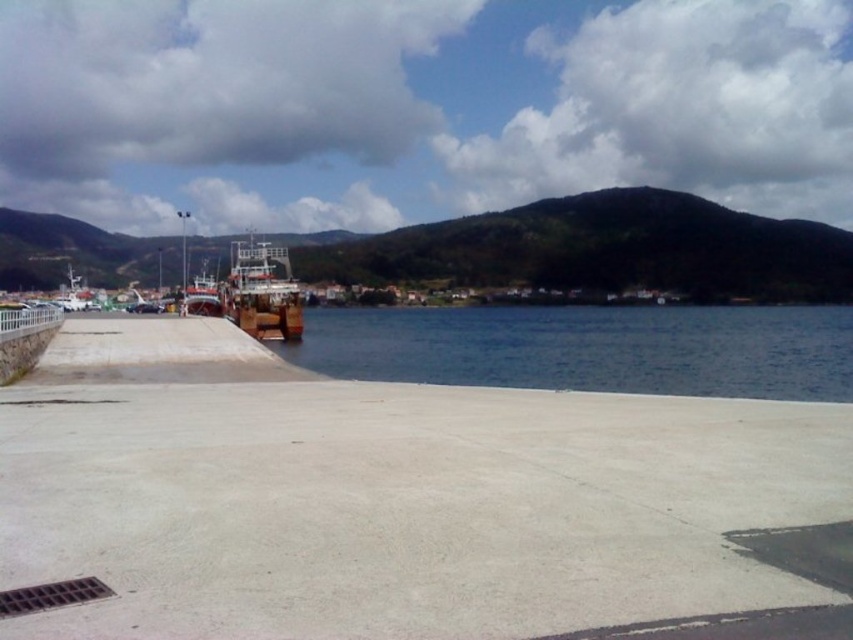
You are standing on the pier and want to board the wooden boat at center. Is the blue water at center between you and the boat, or behind the boat?

The blue water at center has a lesser height compared to wooden boat at center, so the blue water at center is between you and the wooden boat at center.

You are standing on the pier and want to take a photo of the wooden boat at left and the blue water at center. Which object should you point your camera towards first if you want to capture both in one shot?

You should point your camera towards the wooden boat at left first since it is positioned to the left of the blue water at center, allowing both to be captured in the frame.

You are standing on the concrete pavement at the pier and notice two points marked on the ground. One is labeled as point (x=334, y=326) and the other as point (x=94, y=298). If you were to walk from the first point towards the water, would you pass by the second point along the way?

Yes, because point (x=334, y=326) is in front of point (x=94, y=298), meaning it is closer to the water. Walking from point (x=334, y=326) towards the water would not require passing point (x=94, y=298). However, if you were moving from point (x=94, y=298) towards the water, you would pass point (x=334, y=326) first. But since the question specifies starting at point (x=334, y=326) and moving toward the water, you would not pass point (x=94, y=298) along the way.